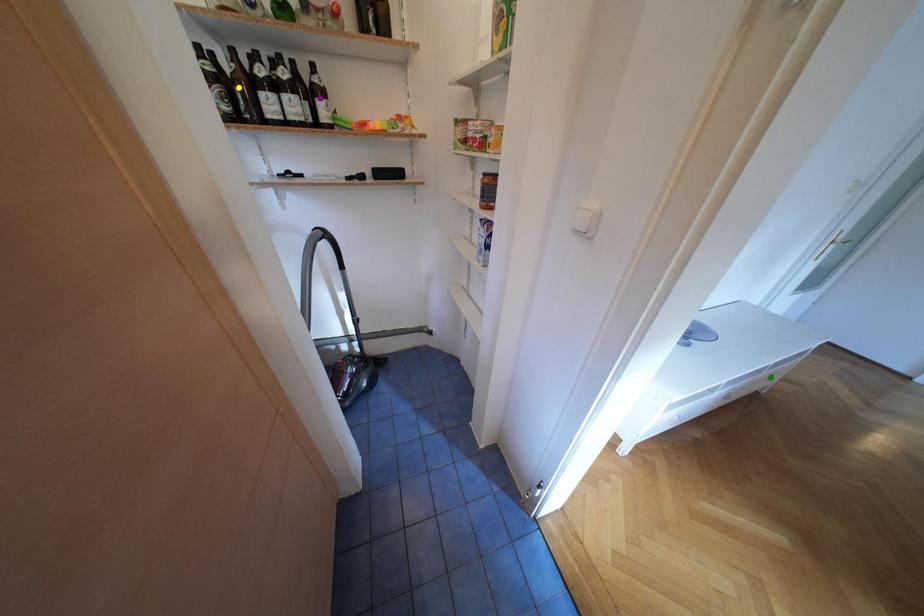
Order these from nearest to farthest:
yellow point
green point
purple point

1. yellow point
2. purple point
3. green point